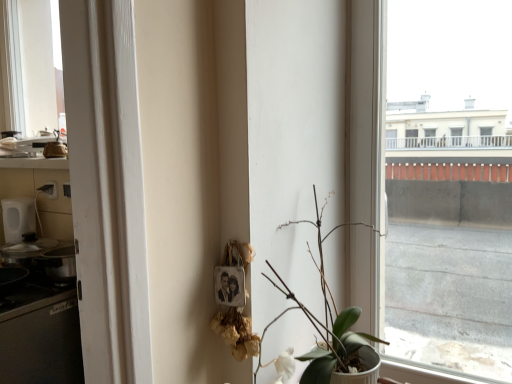
The width and height of the screenshot is (512, 384). What do you see at coordinates (430, 224) in the screenshot? I see `transparent glass window at center` at bounding box center [430, 224].

Image resolution: width=512 pixels, height=384 pixels. In order to click on transparent glass window at center in this screenshot , I will do `click(430, 224)`.

Describe the element at coordinates (325, 318) in the screenshot. The width and height of the screenshot is (512, 384). I see `green matte plant at lower left` at that location.

This screenshot has height=384, width=512. What are the coordinates of `green matte plant at lower left` in the screenshot? It's located at (325, 318).

Identify the location of transparent glass window at center. Image resolution: width=512 pixels, height=384 pixels. (430, 224).

Is green matte plant at lower left at the right side of transparent glass window at center?

No, green matte plant at lower left is not to the right of transparent glass window at center.

Which object is further away from the camera, green matte plant at lower left or transparent glass window at center?

transparent glass window at center.

Is point (349, 223) less distant than point (431, 115)?

Yes, it is in front of point (431, 115).

From the image's perspective, is green matte plant at lower left on top of transparent glass window at center?

No, from the image's perspective, green matte plant at lower left is not on top of transparent glass window at center.

From a real-world perspective, relative to transparent glass window at center, is green matte plant at lower left vertically above or below?

In terms of real-world spatial position, green matte plant at lower left is below transparent glass window at center.

Does green matte plant at lower left have a lesser width compared to transparent glass window at center?

No.

Who is shorter, green matte plant at lower left or transparent glass window at center?

green matte plant at lower left is shorter.

Based on the photo, between green matte plant at lower left and transparent glass window at center, which one has larger size?

green matte plant at lower left is bigger.

Would you say transparent glass window at center is part of green matte plant at lower left's contents?

No.

From the picture: Is green matte plant at lower left beside transparent glass window at center?

No, green matte plant at lower left is not next to transparent glass window at center.

Is green matte plant at lower left looking in the opposite direction of transparent glass window at center?

green matte plant at lower left does not have its back to transparent glass window at center.

What's the angular difference between green matte plant at lower left and transparent glass window at center's facing directions?

The facing directions of green matte plant at lower left and transparent glass window at center are 88.4 degrees apart.

You are a GUI agent. You are given a task and a screenshot of the screen. Output one action in this format:
    pyautogui.click(x=<x>, y=<y>)
    Task: Click on the houseplant below the transparent glass window at center (from the image's perspective)
    Image resolution: width=512 pixels, height=384 pixels.
    Given the screenshot: What is the action you would take?
    pyautogui.click(x=325, y=318)

Between transparent glass window at center and green matte plant at lower left, which one appears on the left side from the viewer's perspective?

green matte plant at lower left is more to the left.

Does transparent glass window at center come behind green matte plant at lower left?

Yes, transparent glass window at center is further from the viewer.

Between point (403, 302) and point (306, 316), which one is positioned behind?

Point (403, 302)

From the image's perspective, is transparent glass window at center above or below green matte plant at lower left?

From the image's perspective, transparent glass window at center appears above green matte plant at lower left.

From a real-world perspective, is transparent glass window at center on top of green matte plant at lower left?

Yes.

Considering the sizes of objects transparent glass window at center and green matte plant at lower left in the image provided, who is thinner, transparent glass window at center or green matte plant at lower left?

Thinner between the two is transparent glass window at center.

Consider the image. Between transparent glass window at center and green matte plant at lower left, which one has less height?

Standing shorter between the two is green matte plant at lower left.

Between transparent glass window at center and green matte plant at lower left, which one has larger size?

Bigger between the two is green matte plant at lower left.

Is green matte plant at lower left located within transparent glass window at center?

That's incorrect, green matte plant at lower left is not inside transparent glass window at center.

Is transparent glass window at center not close to green matte plant at lower left?

No, transparent glass window at center is not far away from green matte plant at lower left.

Is transparent glass window at center facing towards green matte plant at lower left?

Yes, transparent glass window at center is oriented towards green matte plant at lower left.

How different are the orientations of transparent glass window at center and green matte plant at lower left in degrees?

transparent glass window at center and green matte plant at lower left are facing 88.4 degrees away from each other.

Measure the distance from transparent glass window at center to green matte plant at lower left.

transparent glass window at center is 20.87 inches from green matte plant at lower left.

Find the location of a particular element. This screenshot has width=512, height=384. window above the green matte plant at lower left (from the image's perspective) is located at coordinates (430, 224).

Where is `window lying behind the green matte plant at lower left`? The image size is (512, 384). window lying behind the green matte plant at lower left is located at coordinates (430, 224).

This screenshot has width=512, height=384. I want to click on houseplant lying on the left of transparent glass window at center, so click(325, 318).